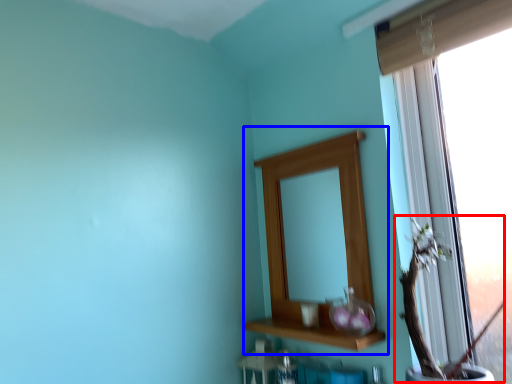
Question: Which object appears closest to the camera in this image, floral arrangement (highlighted by a red box) or medicine cabinet (highlighted by a blue box)?

Choices:
 (A) floral arrangement
 (B) medicine cabinet

Answer: (A)